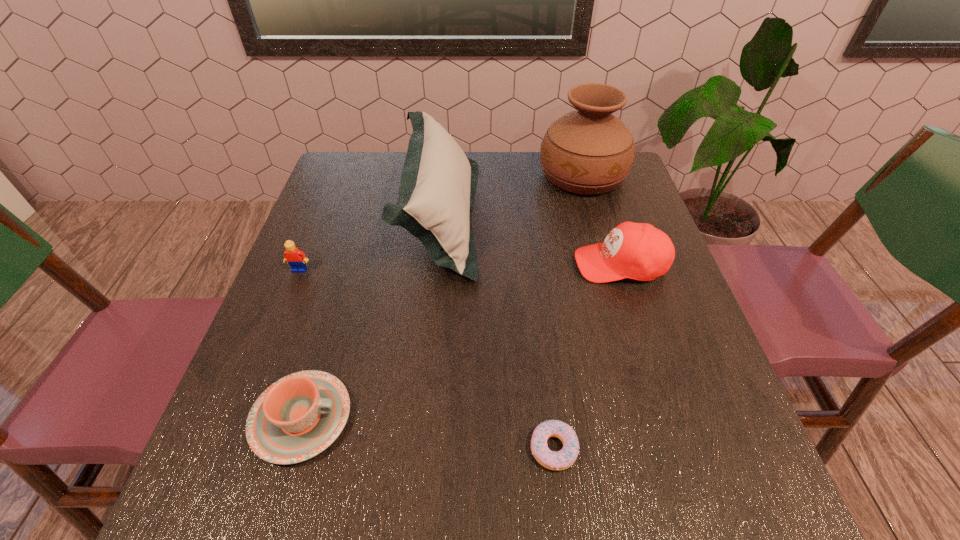
Locate an element on the screen. the tallest object is located at coordinates (588, 151).

This screenshot has height=540, width=960. Identify the location of the fifth shortest object. (438, 183).

This screenshot has height=540, width=960. In order to click on cushion in this screenshot , I will do `click(438, 183)`.

You are a GUI agent. You are given a task and a screenshot of the screen. Output one action in this format:
    pyautogui.click(x=<x>, y=<y>)
    Task: Click on the baseball cap
    The height and width of the screenshot is (540, 960).
    Given the screenshot: What is the action you would take?
    pyautogui.click(x=639, y=251)

The width and height of the screenshot is (960, 540). Find the location of `Lego`. Lego is located at coordinates (296, 258).

Where is `chinaware`? chinaware is located at coordinates [296, 418].

Locate an element on the screen. The width and height of the screenshot is (960, 540). the shortest object is located at coordinates (563, 459).

At what (x,y) coordinates should I click in order to perform the action: click on doughnut. Please return your answer as a coordinate pair (x, y). This screenshot has width=960, height=540. Looking at the image, I should click on (563, 459).

Where is `free space located on the left of the urn`? The width and height of the screenshot is (960, 540). free space located on the left of the urn is located at coordinates (451, 176).

In order to click on vacant space located 0.080m on the surface of the cushion in this screenshot , I will do `click(510, 217)`.